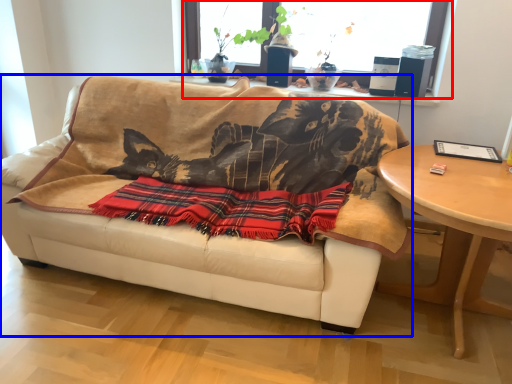
Question: Which of the following is the farthest to the observer, window (highlighted by a red box) or studio couch (highlighted by a blue box)?

Choices:
 (A) window
 (B) studio couch

Answer: (A)